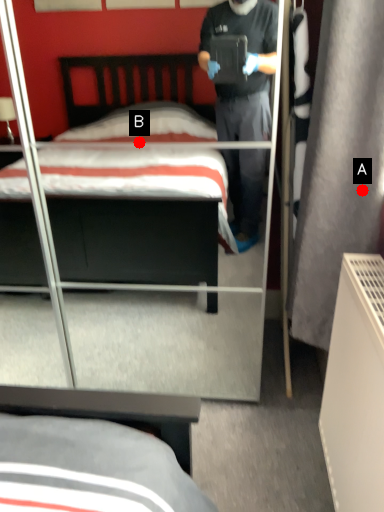
Question: Two points are circled on the image, labeled by A and B beside each circle. Among these points, which one is nearest to the camera?

Choices:
 (A) A is closer
 (B) B is closer

Answer: (A)